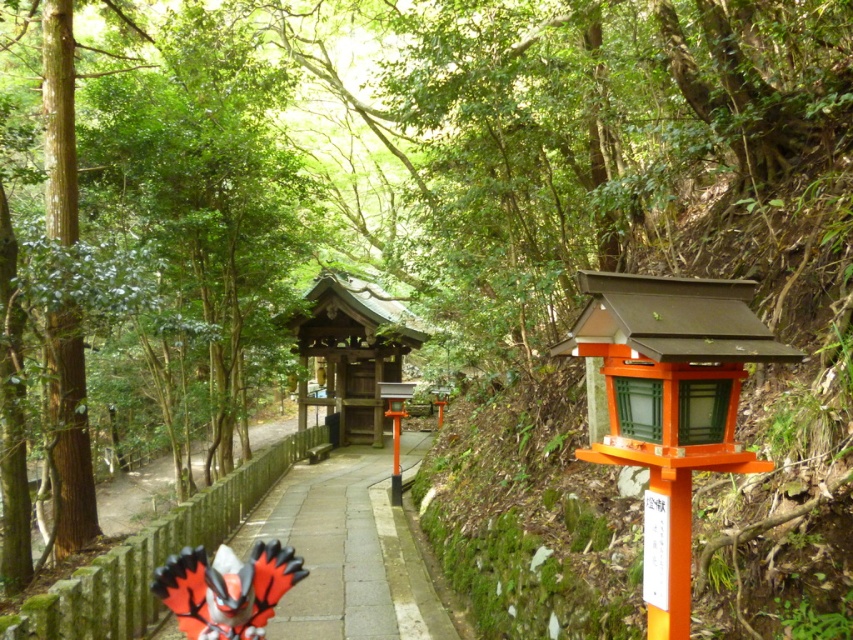
You are standing at point (346, 554) on the serene forest pathway. What object is located exactly at your current position?

The smooth stone path at center is located exactly at point (346, 554).

You are a visitor walking along the smooth stone path at center and notice an orange matte butterfly at lower left. Which object is positioned lower in the image?

The smooth stone path at center is below the orange matte butterfly at lower left, so the smooth stone path at center is positioned lower in the image.